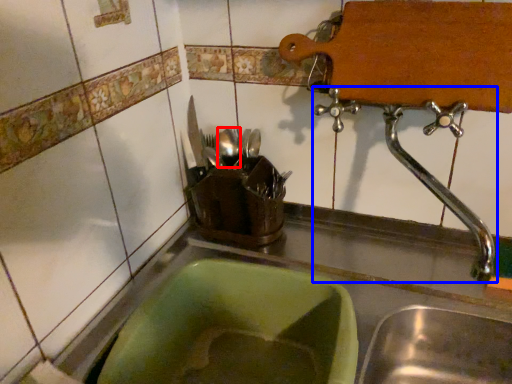
Question: Which point is further to the camera, tableware (highlighted by a red box) or tap (highlighted by a blue box)?

Choices:
 (A) tableware
 (B) tap

Answer: (A)